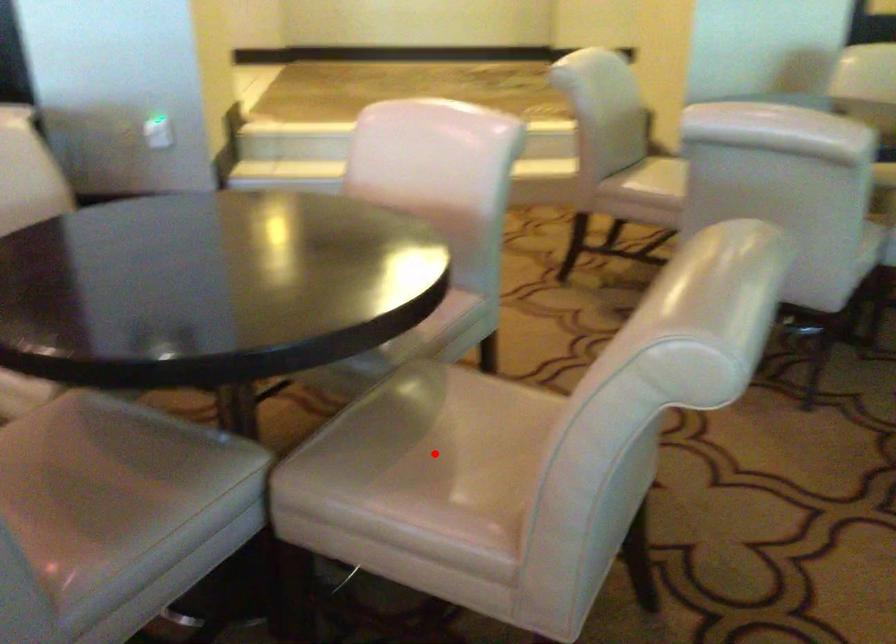
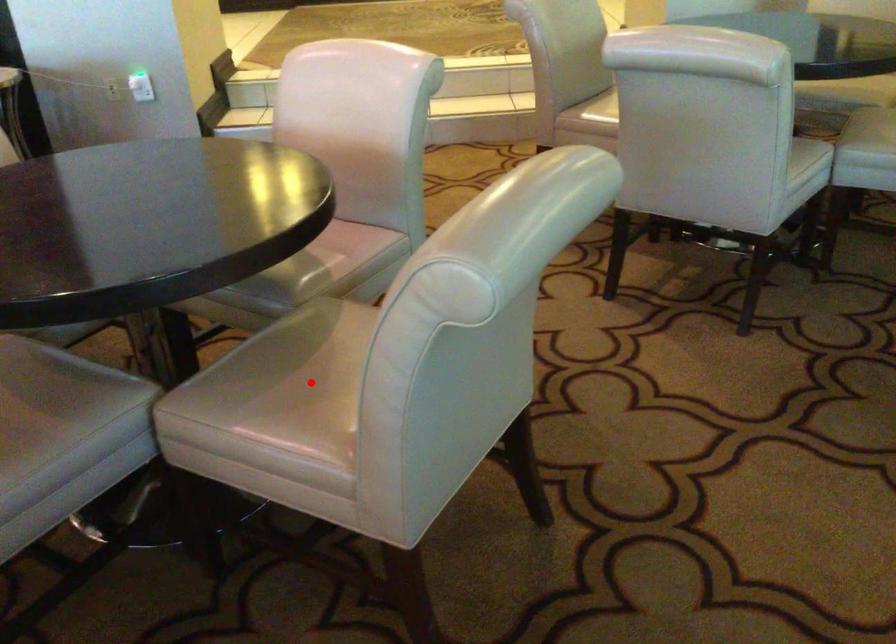
I am providing you with two images of the same scene from different viewpoints. A red point is marked on the first image and another point is marked on the second image. Do the highlighted points in image1 and image2 indicate the same real-world spot?

Yes